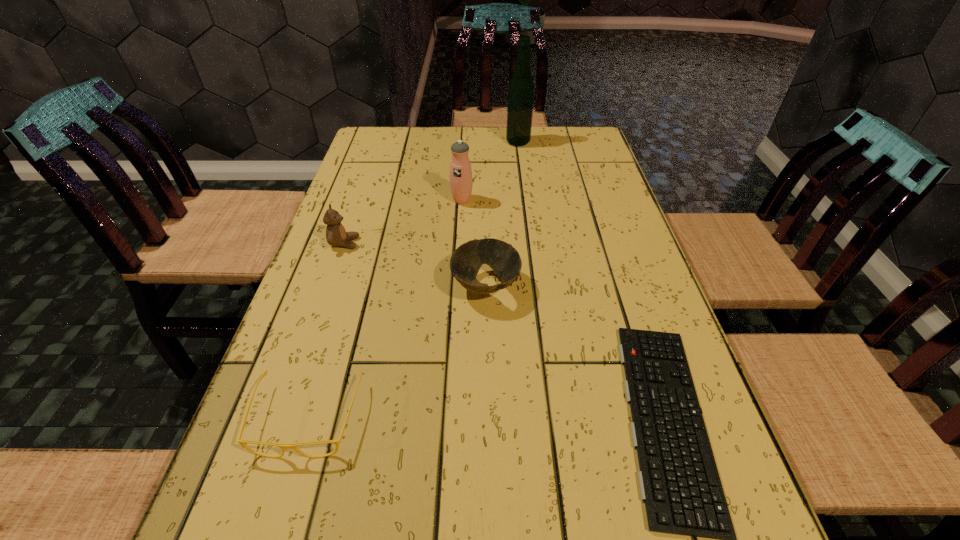
The image size is (960, 540). What are the coordinates of `free region located on the front of the fifth nearest object` in the screenshot? It's located at (456, 307).

This screenshot has width=960, height=540. In order to click on free location located on the front-facing side of the fourth shortest object in this screenshot , I will do `click(492, 243)`.

Where is `free location located 0.230m on the left of the bowl`? This screenshot has width=960, height=540. free location located 0.230m on the left of the bowl is located at coordinates (348, 287).

In order to click on free location located in front of the lenses of the spectacles in this screenshot , I will do `click(276, 522)`.

Find the location of a particular element. object that is at the far edge is located at coordinates (521, 88).

Find the location of a particular element. The image size is (960, 540). teddy bear situated at the left edge is located at coordinates (336, 235).

The image size is (960, 540). Identify the location of spectacles present at the left edge. (283, 446).

You are a GUI agent. You are given a task and a screenshot of the screen. Output one action in this format:
    pyautogui.click(x=<x>, y=<y>)
    Task: Click on the vacant space at the far edge
    The width and height of the screenshot is (960, 540).
    Given the screenshot: What is the action you would take?
    [542, 141]

The height and width of the screenshot is (540, 960). I want to click on blank area at the left edge, so click(x=240, y=467).

I want to click on blank space at the right edge of the desktop, so click(x=564, y=171).